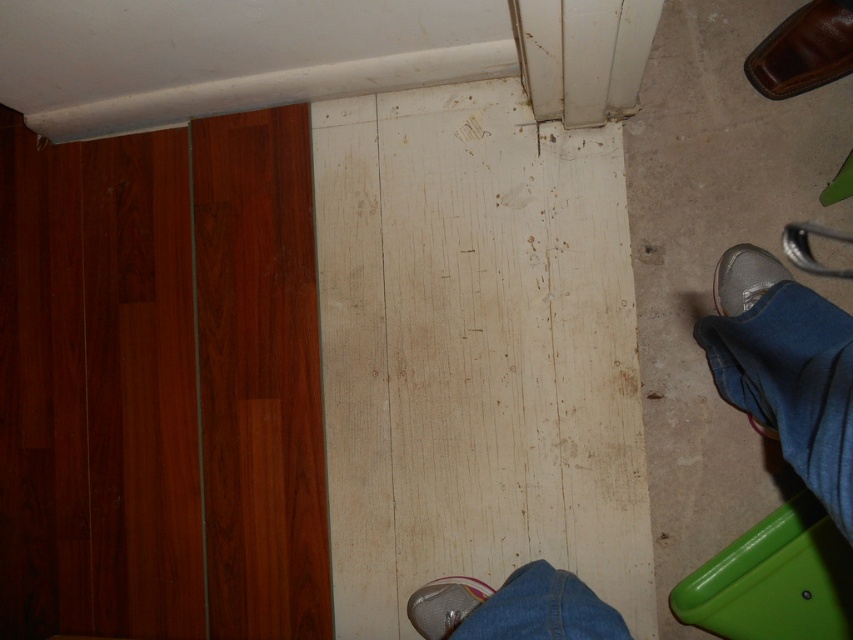
Which is more to the right, brown leather shoe at upper right or silver metallic shoe at lower right?

Positioned to the right is brown leather shoe at upper right.

At what (x,y) coordinates should I click in order to perform the action: click on brown leather shoe at upper right. Please return your answer as a coordinate pair (x, y). The image size is (853, 640). Looking at the image, I should click on (804, 51).

Locate an element on the screen. Image resolution: width=853 pixels, height=640 pixels. brown leather shoe at upper right is located at coordinates (804, 51).

Is point (796, 28) behind point (418, 593)?

No.

Is point (793, 80) in front of point (445, 589)?

Yes, point (793, 80) is in front of point (445, 589).

Find the location of a particular element. Image resolution: width=853 pixels, height=640 pixels. brown leather shoe at upper right is located at coordinates (804, 51).

Can you confirm if denim pants at lower right is positioned above metallic silver shoe at lower center?

Yes.

Does denim pants at lower right have a greater height compared to metallic silver shoe at lower center?

Indeed, denim pants at lower right has a greater height compared to metallic silver shoe at lower center.

Where is `denim pants at lower right`? This screenshot has height=640, width=853. denim pants at lower right is located at coordinates (792, 384).